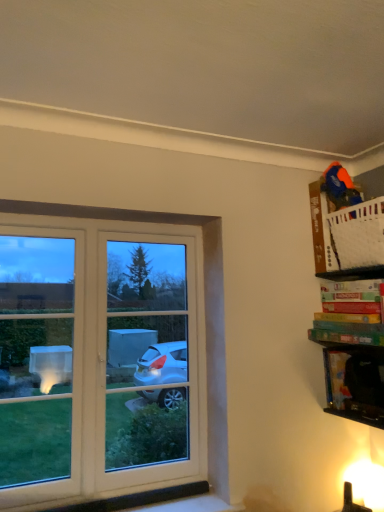
Question: Is multicolored cardboard game at upper right, placed as the first book when sorted from top to bottom, aimed at black plastic cabinet at lower right?

Choices:
 (A) no
 (B) yes

Answer: (A)

Question: Is multicolored cardboard game at upper right, placed as the first book when sorted from top to bottom, shorter than black plastic cabinet at lower right?

Choices:
 (A) yes
 (B) no

Answer: (A)

Question: Is multicolored cardboard game at upper right, positioned as the second book in bottom-to-top order, bigger than black plastic cabinet at lower right?

Choices:
 (A) no
 (B) yes

Answer: (B)

Question: Is multicolored cardboard game at upper right, positioned as the second book in bottom-to-top order, thinner than black plastic cabinet at lower right?

Choices:
 (A) no
 (B) yes

Answer: (A)

Question: Could black plastic cabinet at lower right be considered to be inside multicolored cardboard game at upper right, placed as the first book when sorted from top to bottom?

Choices:
 (A) yes
 (B) no

Answer: (B)

Question: Is multicolored cardboard game at upper right, placed as the first book when sorted from top to bottom, taller than black plastic cabinet at lower right?

Choices:
 (A) yes
 (B) no

Answer: (B)

Question: Is green matte board game at upper right, which is the first book in bottom-to-top order, at the back of black plastic cabinet at lower right?

Choices:
 (A) no
 (B) yes

Answer: (A)

Question: From the image's perspective, is black plastic cabinet at lower right on green matte board game at upper right, which is the first book in bottom-to-top order?

Choices:
 (A) no
 (B) yes

Answer: (A)

Question: Considering the relative sizes of black plastic cabinet at lower right and green matte board game at upper right, the second book from the top, in the image provided, is black plastic cabinet at lower right shorter than green matte board game at upper right, the second book from the top,?

Choices:
 (A) no
 (B) yes

Answer: (A)

Question: From a real-world perspective, is black plastic cabinet at lower right below green matte board game at upper right, the second book from the top?

Choices:
 (A) yes
 (B) no

Answer: (A)

Question: Is black plastic cabinet at lower right beside green matte board game at upper right, which is the first book in bottom-to-top order?

Choices:
 (A) yes
 (B) no

Answer: (B)

Question: Is black plastic cabinet at lower right at the right side of green matte board game at upper right, the second book from the top?

Choices:
 (A) no
 (B) yes

Answer: (A)

Question: From a real-world perspective, is green matte board game at upper right, which is the first book in bottom-to-top order, beneath black plastic cabinet at lower right?

Choices:
 (A) yes
 (B) no

Answer: (B)